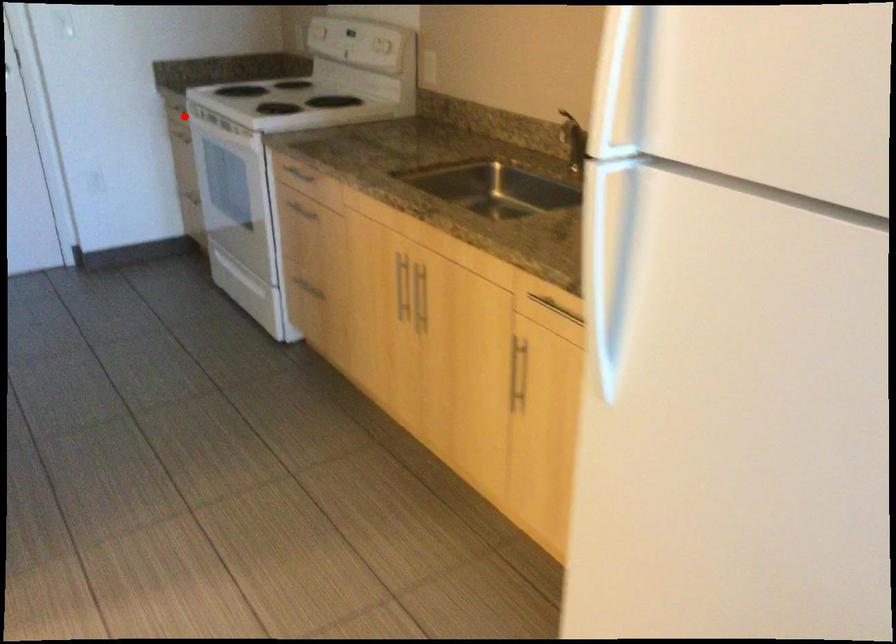
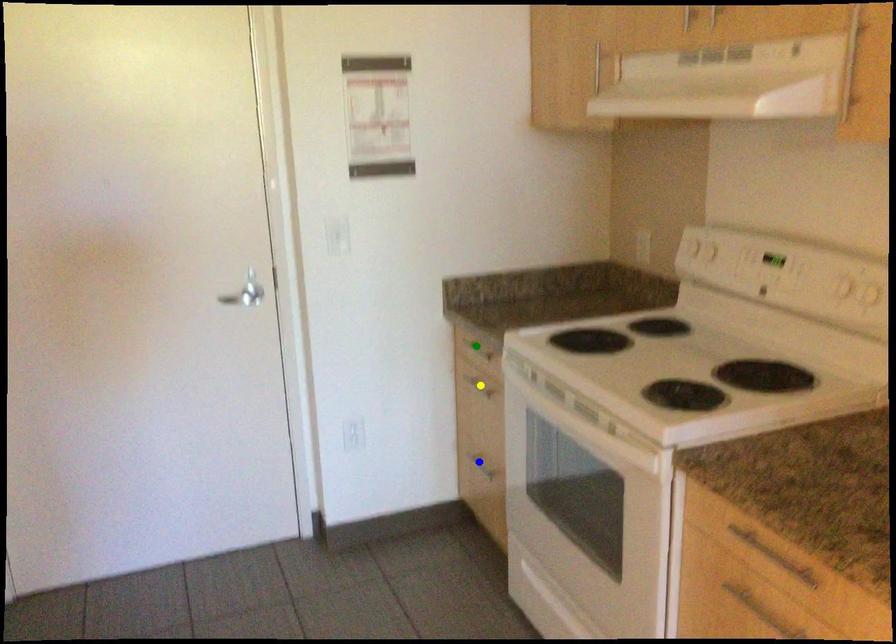
Question: I am providing you with two images of the same scene from different viewpoints. A red point is marked on the first image. You are given multiple points on the second image. Which mark in image 2 goes with the point in image 1?

Choices:
 (A) blue point
 (B) yellow point
 (C) green point

Answer: (C)